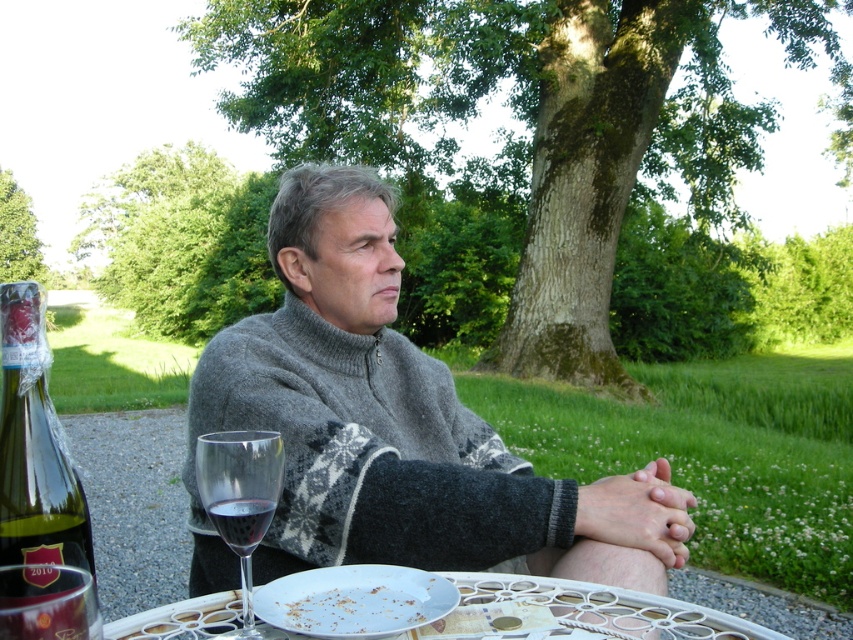
Question: Which of these objects is positioned farthest from the transparent glass at table center?

Choices:
 (A) white matte plate at lower center
 (B) translucent glass at table center
 (C) green glass bottle at lower left
 (D) white porcelain plate at lower center

Answer: (C)

Question: Which point is closer to the camera?

Choices:
 (A) white porcelain plate at lower center
 (B) gray wool sweater at center
 (C) green glass bottle at lower left
 (D) white matte plate at lower center

Answer: (C)

Question: Among these objects, which one is nearest to the camera?

Choices:
 (A) green glass bottle at lower left
 (B) transparent glass at table center
 (C) white plastic plate at lower center
 (D) white porcelain plate at lower center

Answer: (A)

Question: Observing the image, what is the correct spatial positioning of transparent glass at table center in reference to translucent glass at table center?

Choices:
 (A) below
 (B) above

Answer: (B)

Question: From the image, what is the correct spatial relationship of gray wool sweater at center in relation to white plastic plate at lower center?

Choices:
 (A) below
 (B) above

Answer: (B)

Question: Does gray wool sweater at center come behind green glass bottle at lower left?

Choices:
 (A) yes
 (B) no

Answer: (A)